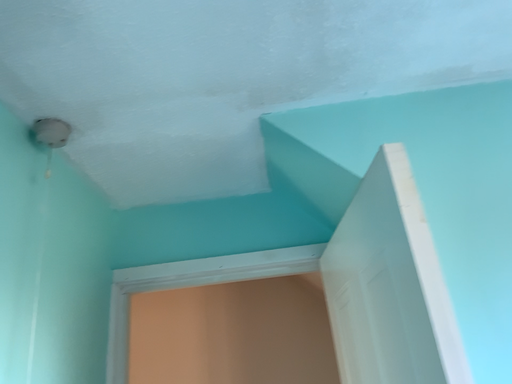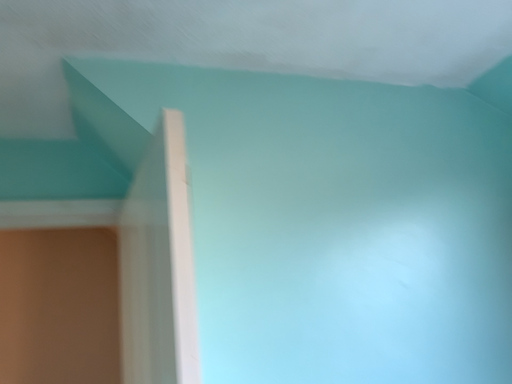
Question: Which way did the camera rotate in the video?

Choices:
 (A) rotated left
 (B) rotated right

Answer: (B)